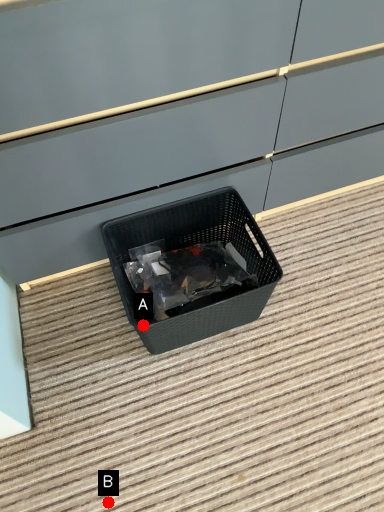
Question: Two points are circled on the image, labeled by A and B beside each circle. Which of the following is the farthest from the observer?

Choices:
 (A) A is further
 (B) B is further

Answer: (A)